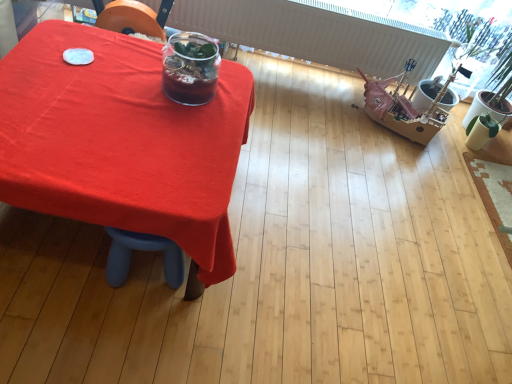
Question: Is point (135, 137) closer or farther from the camera than point (178, 44)?

Choices:
 (A) farther
 (B) closer

Answer: (B)

Question: From the image's perspective, is matte red tablecloth at center above or below translucent glass jar at center?

Choices:
 (A) below
 (B) above

Answer: (A)

Question: Is matte red tablecloth at center situated inside translucent glass jar at center or outside?

Choices:
 (A) inside
 (B) outside

Answer: (B)

Question: From a real-world perspective, is translucent glass jar at center positioned above or below matte red tablecloth at center?

Choices:
 (A) below
 (B) above

Answer: (B)

Question: In the image, is translucent glass jar at center on the left side or the right side of matte red tablecloth at center?

Choices:
 (A) right
 (B) left

Answer: (A)

Question: In terms of height, does translucent glass jar at center look taller or shorter compared to matte red tablecloth at center?

Choices:
 (A) short
 (B) tall

Answer: (A)

Question: Looking at the image, does translucent glass jar at center seem bigger or smaller compared to matte red tablecloth at center?

Choices:
 (A) small
 (B) big

Answer: (A)